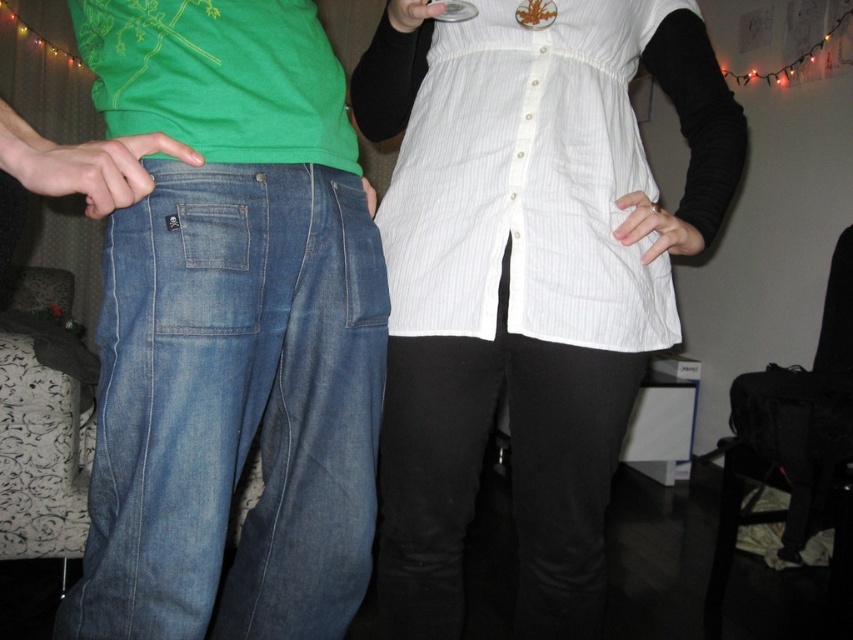
Between white striped apron at center and matte green t-shirt at center, which one appears on the left side from the viewer's perspective?

matte green t-shirt at center is more to the left.

Who is positioned more to the right, white striped apron at center or matte green t-shirt at center?

From the viewer's perspective, white striped apron at center appears more on the right side.

What do you see at coordinates (527, 180) in the screenshot?
I see `white striped apron at center` at bounding box center [527, 180].

This screenshot has width=853, height=640. In order to click on white striped apron at center in this screenshot , I will do `click(527, 180)`.